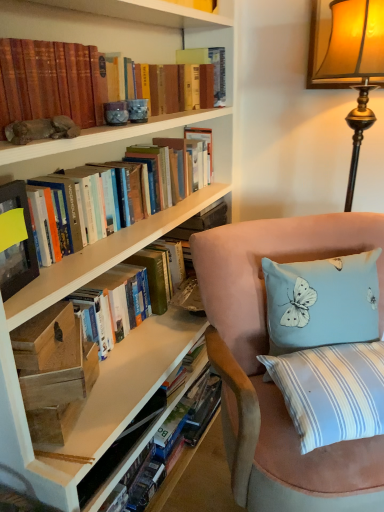
The image size is (384, 512). Describe the element at coordinates (42, 336) in the screenshot. I see `wooden box at lower left, which ranks as the second paperback book in bottom-to-top order` at that location.

The image size is (384, 512). What do you see at coordinates (355, 65) in the screenshot? I see `gold textured lampshade at upper right` at bounding box center [355, 65].

You are a GUI agent. You are given a task and a screenshot of the screen. Output one action in this format:
    pyautogui.click(x=<x>, y=<y>)
    Task: Click on the suede chair at lower right
    This screenshot has width=384, height=512.
    Given the screenshot: What is the action you would take?
    pyautogui.click(x=264, y=369)

Measure the distance between point (x=128, y=167) and camera.

Point (x=128, y=167) is 1.39 meters from camera.

How much space does matte black book at left, which ranks as the second paperback book in top-to-bottom order, occupy horizontally?

matte black book at left, which ranks as the second paperback book in top-to-bottom order, is 2.42 inches wide.

Where is `wooden box at lower left, which is the third paperback book from right to left`? Image resolution: width=384 pixels, height=512 pixels. wooden box at lower left, which is the third paperback book from right to left is located at coordinates (42, 336).

Between light blue fabric pillow with butterfly design at right and hardcover book at upper center, which is counted as the 4th paperback book, starting from the front, which one appears on the left side from the viewer's perspective?

hardcover book at upper center, which is counted as the 4th paperback book, starting from the front, is more to the left.

Which is nearer, (345, 335) or (192, 61)?

Clearly, point (345, 335) is closer to the camera than point (192, 61).

How different are the orientations of light blue fabric pillow with butterfly design at right and hardcover book at upper center, which is counted as the 4th paperback book, starting from the front, in degrees?

There is a 50-degree angle between the facing directions of light blue fabric pillow with butterfly design at right and hardcover book at upper center, which is counted as the 4th paperback book, starting from the front.

In order to click on pillow that appears below the hardcover book at upper center, placed as the fourth paperback book when sorted from bottom to top (from the image's perspective) in this screenshot , I will do `click(322, 301)`.

Considering the sizes of light blue fabric pillow with butterfly design at right and wooden plank at lower left, the 2th paperback book in the right-to-left sequence, in the image, is light blue fabric pillow with butterfly design at right bigger or smaller than wooden plank at lower left, the 2th paperback book in the right-to-left sequence,?

In the image, light blue fabric pillow with butterfly design at right appears to be larger than wooden plank at lower left, the 2th paperback book in the right-to-left sequence.

Considering the sizes of light blue fabric pillow with butterfly design at right and wooden plank at lower left, marked as the second paperback book in a back-to-front arrangement, in the image, is light blue fabric pillow with butterfly design at right wider or thinner than wooden plank at lower left, marked as the second paperback book in a back-to-front arrangement,?

In the image, light blue fabric pillow with butterfly design at right appears to be more narrow than wooden plank at lower left, marked as the second paperback book in a back-to-front arrangement.

From a real-world perspective, is light blue fabric pillow with butterfly design at right physically below wooden plank at lower left, the 2th paperback book in the right-to-left sequence?

No, from a real-world perspective, light blue fabric pillow with butterfly design at right is not under wooden plank at lower left, the 2th paperback book in the right-to-left sequence.

Does point (283, 315) come farther from viewer compared to point (353, 142)?

No, (283, 315) is in front of (353, 142).

Who is smaller, light blue fabric pillow with butterfly design at right or gold textured lampshade at upper right?

light blue fabric pillow with butterfly design at right.

Does light blue fabric pillow with butterfly design at right come behind gold textured lampshade at upper right?

No.

From the picture: Which of these two, wooden box at lower left, the second paperback book in the front-to-back sequence, or gold textured lampshade at upper right, is thinner?

Thinner between the two is wooden box at lower left, the second paperback book in the front-to-back sequence.

How far apart are wooden box at lower left, which ranks as the second paperback book in bottom-to-top order, and gold textured lampshade at upper right?

A distance of 3.73 feet exists between wooden box at lower left, which ranks as the second paperback book in bottom-to-top order, and gold textured lampshade at upper right.

From a real-world perspective, which is physically below, wooden box at lower left, the second paperback book in the front-to-back sequence, or gold textured lampshade at upper right?

wooden box at lower left, the second paperback book in the front-to-back sequence, is physically lower.

From the image's perspective, which object appears higher, wooden box at lower left, the second paperback book in the front-to-back sequence, or gold textured lampshade at upper right?

gold textured lampshade at upper right, from the image's perspective.

From the image's perspective, which one is positioned higher, wooden plank at lower left, which ranks as the first paperback book in bottom-to-top order, or gold textured lampshade at upper right?

gold textured lampshade at upper right.

In terms of width, does wooden plank at lower left, the 2th paperback book in the right-to-left sequence, look wider or thinner when compared to gold textured lampshade at upper right?

In the image, wooden plank at lower left, the 2th paperback book in the right-to-left sequence, appears to be more narrow than gold textured lampshade at upper right.

How much distance is there between wooden plank at lower left, which ranks as the first paperback book in bottom-to-top order, and gold textured lampshade at upper right?

A distance of 3.73 feet exists between wooden plank at lower left, which ranks as the first paperback book in bottom-to-top order, and gold textured lampshade at upper right.

Are wooden plank at lower left, which ranks as the first paperback book in bottom-to-top order, and gold textured lampshade at upper right beside each other?

wooden plank at lower left, which ranks as the first paperback book in bottom-to-top order, and gold textured lampshade at upper right are clearly separated.

Would you say hardcover book at upper center, placed as the fourth paperback book when sorted from bottom to top, is part of wooden plank at lower left, the third paperback book viewed from the left,'s contents?

No, wooden plank at lower left, the third paperback book viewed from the left, does not contain hardcover book at upper center, placed as the fourth paperback book when sorted from bottom to top.

In terms of size, does wooden plank at lower left, the 2th paperback book in the right-to-left sequence, appear bigger or smaller than hardcover book at upper center, which is counted as the 4th paperback book, starting from the front?

Clearly, wooden plank at lower left, the 2th paperback book in the right-to-left sequence, is larger in size than hardcover book at upper center, which is counted as the 4th paperback book, starting from the front.

From the image's perspective, which paperback book is the 3rd one above the wooden plank at lower left, the 2th paperback book in the right-to-left sequence? Please provide its 2D coordinates.

[(208, 63)]

Is wooden plank at lower left, the 4th paperback book in the top-to-bottom sequence, taller or shorter than hardcover book at upper center, placed as the fourth paperback book when sorted from bottom to top?

Clearly, wooden plank at lower left, the 4th paperback book in the top-to-bottom sequence, is shorter compared to hardcover book at upper center, placed as the fourth paperback book when sorted from bottom to top.

Is point (197, 172) more distant than point (24, 368)?

Yes, it is behind point (24, 368).

Which object is further away from the camera taking this photo, hardcover books at upper left, the 1th book positioned from the top, or wooden plank at lower left, the 4th paperback book in the top-to-bottom sequence?

wooden plank at lower left, the 4th paperback book in the top-to-bottom sequence, is further away from the camera.

From a real-world perspective, which book is the 2nd one above the wooden plank at lower left, the 4th paperback book in the top-to-bottom sequence? Please provide its 2D coordinates.

[(145, 182)]

Is hardcover books at upper left, which is the 2th book in bottom-to-top order, wider or thinner than wooden plank at lower left, marked as the second paperback book in a back-to-front arrangement?

Clearly, hardcover books at upper left, which is the 2th book in bottom-to-top order, has less width compared to wooden plank at lower left, marked as the second paperback book in a back-to-front arrangement.

The height and width of the screenshot is (512, 384). Find the location of `pillow on the right of the hardcover book at upper center, placed as the first paperback book when sorted from back to front`. pillow on the right of the hardcover book at upper center, placed as the first paperback book when sorted from back to front is located at coordinates (322, 301).

Find the location of `the 1st paperback book in front of the light blue fabric pillow with butterfly design at right, starting your count from the anchor`. the 1st paperback book in front of the light blue fabric pillow with butterfly design at right, starting your count from the anchor is located at coordinates (53, 368).

When comparing their distances from suede chair at lower right, does wooden box at lower left, which is the third paperback book from right to left, or light blue fabric pillow with butterfly design at right seem further?

wooden box at lower left, which is the third paperback book from right to left, is positioned further to the anchor suede chair at lower right.

Estimate the real-world distances between objects in this image. Which object is further from hardcover book at center, acting as the 1th book starting from the bottom, wooden plank at lower left, which ranks as the first paperback book in bottom-to-top order, or gold textured lampshade at upper right?

gold textured lampshade at upper right is further to hardcover book at center, acting as the 1th book starting from the bottom.

From the picture: Looking at the image, which one is located further to hardcover book at upper center, the 4th paperback book from the left, hardcover book at center, which ranks as the 2th book in top-to-bottom order, or gold textured lampshade at upper right?

hardcover book at center, which ranks as the 2th book in top-to-bottom order, lies further to hardcover book at upper center, the 4th paperback book from the left, than the other object.

Consider the image. Based on their spatial positions, is hardcover book at center, which ranks as the 2th book in top-to-bottom order, or wooden plank at lower left, marked as the second paperback book in a back-to-front arrangement, closer to hardcover book at upper center, which is counted as the 4th paperback book, starting from the front?

hardcover book at center, which ranks as the 2th book in top-to-bottom order, is positioned closer to the anchor hardcover book at upper center, which is counted as the 4th paperback book, starting from the front.

Looking at the image, which one is located closer to hardcover book at center, which ranks as the 2th book in top-to-bottom order, wooden box at lower left, the 3th paperback book positioned from the back, or light blue fabric pillow with butterfly design at right?

The object closer to hardcover book at center, which ranks as the 2th book in top-to-bottom order, is wooden box at lower left, the 3th paperback book positioned from the back.

Considering their positions, is suede chair at lower right positioned closer to matte black book at left, which appears as the 3th paperback book when ordered from the bottom, than light blue fabric pillow with butterfly design at right?

suede chair at lower right.

Based on their spatial positions, is light blue fabric pillow with butterfly design at right or matte black book at left, which is counted as the 4th paperback book, starting from the right, closer to wooden plank at lower left, the 2th paperback book in the right-to-left sequence?

The object closer to wooden plank at lower left, the 2th paperback book in the right-to-left sequence, is matte black book at left, which is counted as the 4th paperback book, starting from the right.

Based on their spatial positions, is hardcover books at upper left, which is the 2th book in bottom-to-top order, or wooden plank at lower left, which is the third paperback book from front to back, closer to gold textured lampshade at upper right?

hardcover books at upper left, which is the 2th book in bottom-to-top order, is closer to gold textured lampshade at upper right.

At what (x,y) coordinates should I click in order to perform the action: click on pillow that lies between hardcover book at upper center, positioned as the 1th paperback book in top-to-bottom order, and suede chair at lower right from top to bottom. Please return your answer as a coordinate pair (x, y). Image resolution: width=384 pixels, height=512 pixels. Looking at the image, I should click on (322, 301).

You are a GUI agent. You are given a task and a screenshot of the screen. Output one action in this format:
    pyautogui.click(x=<x>, y=<y>)
    Task: Click on the table lamp that lies between hardcover book at upper center, placed as the first paperback book when sorted from back to front, and hardcover book at center, which ranks as the 2th book in top-to-bottom order, from top to bottom
    
    Given the screenshot: What is the action you would take?
    pyautogui.click(x=355, y=65)

Identify the location of pillow between wooden box at lower left, which ranks as the second paperback book in bottom-to-top order, and gold textured lampshade at upper right from left to right. (322, 301).

Find the location of a particular element. The width and height of the screenshot is (384, 512). pillow situated between wooden plank at lower left, marked as the second paperback book in a back-to-front arrangement, and gold textured lampshade at upper right from left to right is located at coordinates (322, 301).